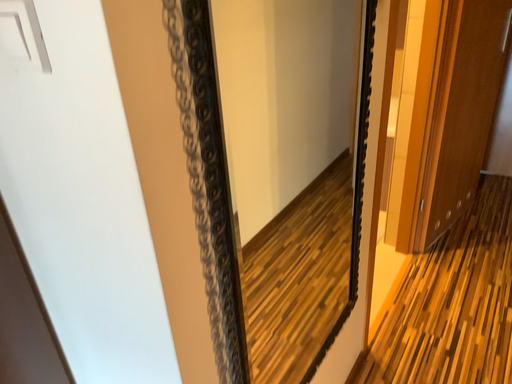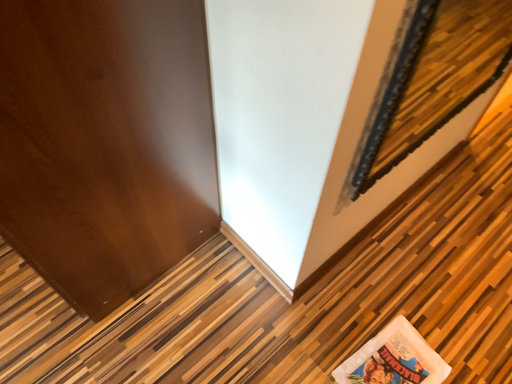
Question: Which way did the camera rotate in the video?

Choices:
 (A) rotated left
 (B) rotated right

Answer: (A)